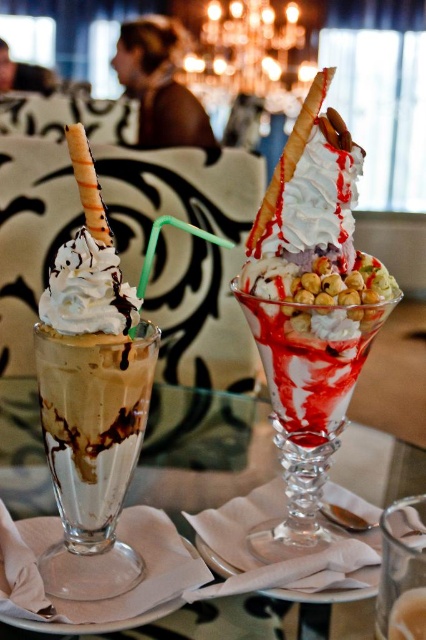
You are a food critic standing at the table. You want to take a photo of the white creamy ice cream sundae at center. Which direction should you move to get a better angle?

The white creamy ice cream sundae at center is located at point (310,308), so you should move slightly to the right to center it in your photo.

You are a food delivery person who needs to transport both the white creamy ice cream sundae at center and the transparent glass table at center in a box. Considering their heights, which item might require a taller box to avoid spilling?

The white creamy ice cream sundae at center has a greater height compared to the transparent glass table at center, so it would require a taller box to accommodate its height and prevent spilling.

You are a waiter carrying a tray of dishes. You need to place a new dessert between the white creamy ice cream sundae at center and the transparent glass table at center. Can you fit it there without moving either of them?

The distance between the white creamy ice cream sundae at center and the transparent glass table at center is 5.01 inches. Since the space is just over 5 inches, it depends on the size of the new dessert. If the dessert is less than or equal to 5.01 inches in width, it can fit between them. However, if it exceeds that, it won